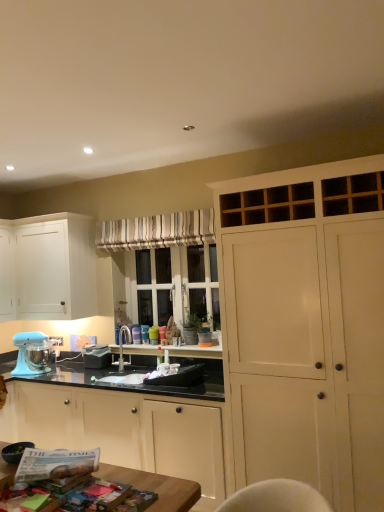
Question: Is satin nickel faucet at center spatially inside white matte cabinet at left, acting as the 1th cabinetry starting from the left, or outside of it?

Choices:
 (A) outside
 (B) inside

Answer: (A)

Question: In terms of height, does satin nickel faucet at center look taller or shorter compared to white matte cabinet at left, acting as the 1th cabinetry starting from the left?

Choices:
 (A) tall
 (B) short

Answer: (B)

Question: Which is nearer to the satin nickel faucet at center?

Choices:
 (A) white wood cabinet at right, which appears as the 3th cabinetry when viewed from the left
 (B) matte blue mixer at lower left
 (C) white matte cabinet at left, which is counted as the 3th cabinetry, starting from the right
 (D) matte white cabinet at center, the 2th cabinetry from the left
 (E) matte black coffee maker at center

Answer: (E)

Question: Which object is the farthest from the matte blue mixer at lower left?

Choices:
 (A) matte black coffee maker at center
 (B) matte white cabinet at center, the 2th cabinetry from the left
 (C) white wood cabinet at right, which appears as the 3th cabinetry when viewed from the left
 (D) white matte cabinet at left, acting as the 1th cabinetry starting from the left
 (E) striped fabric curtain at center

Answer: (C)